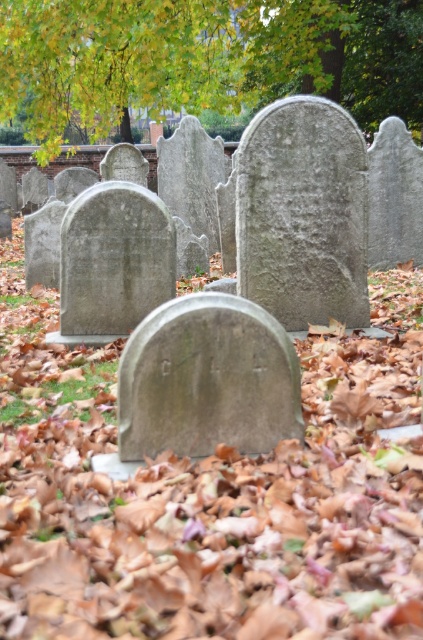
Does green leafy tree at upper center have a greater width compared to gray stone gravestone at center?

No, green leafy tree at upper center is not wider than gray stone gravestone at center.

The height and width of the screenshot is (640, 423). I want to click on green leafy tree at upper center, so click(x=203, y=58).

Which is in front, point (337, 0) or point (282, 403)?

Positioned in front is point (282, 403).

The image size is (423, 640). I want to click on green leafy tree at upper center, so click(203, 58).